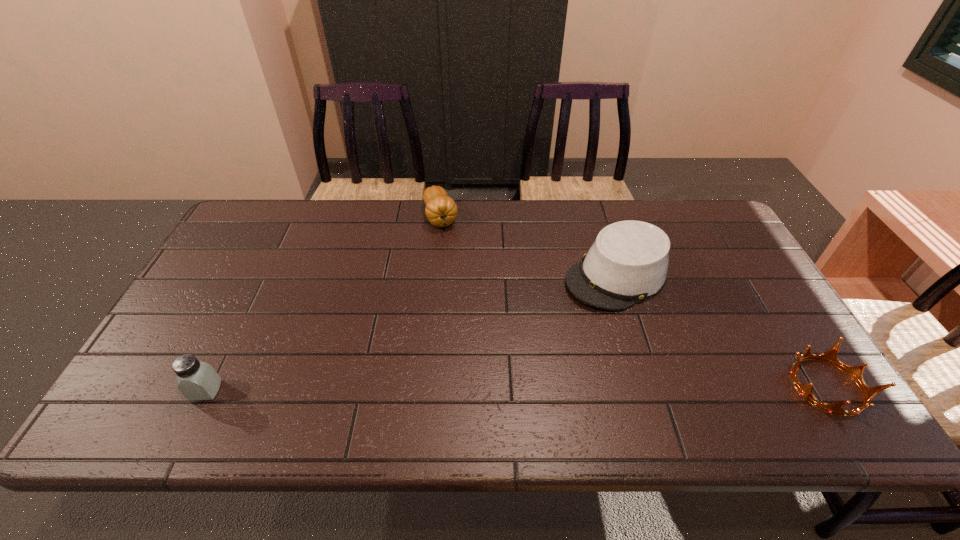
Find the location of a particular element. This screenshot has height=540, width=960. vacant point located on the front-facing side of the third object from left to right is located at coordinates (458, 372).

Locate an element on the screen. This screenshot has width=960, height=540. vacant position located 0.080m on the front-facing side of the third object from left to right is located at coordinates (557, 310).

Where is `blank space located 0.310m on the stem side of the second object from left to right`? blank space located 0.310m on the stem side of the second object from left to right is located at coordinates (469, 306).

This screenshot has width=960, height=540. I want to click on free spot located 0.140m on the stem side of the second object from left to right, so click(x=454, y=265).

You are a GUI agent. You are given a task and a screenshot of the screen. Output one action in this format:
    pyautogui.click(x=<x>, y=<y>)
    Task: Click on the vacant area situated 0.170m on the stem side of the second object from left to right
    The width and height of the screenshot is (960, 540).
    Given the screenshot: What is the action you would take?
    pyautogui.click(x=457, y=272)

I want to click on hat positioned at the far edge, so click(628, 262).

Where is `gourd located at the far edge`? gourd located at the far edge is located at coordinates (441, 210).

Locate an element on the screen. Image resolution: width=960 pixels, height=540 pixels. saltshaker that is at the near edge is located at coordinates (197, 380).

Locate an element on the screen. crown present at the near edge is located at coordinates (855, 372).

Locate an element on the screen. The height and width of the screenshot is (540, 960). object situated at the left edge is located at coordinates (197, 380).